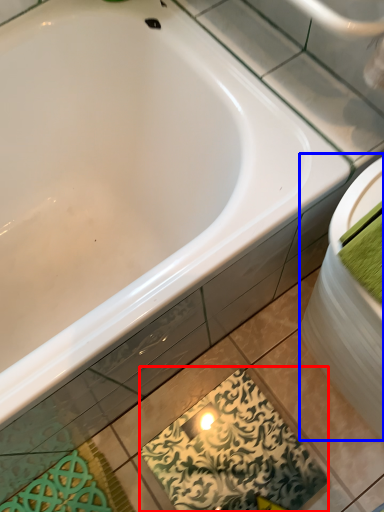
Question: Which object appears closest to the camera in this image, design (highlighted by a red box) or sink (highlighted by a blue box)?

Choices:
 (A) design
 (B) sink

Answer: (B)